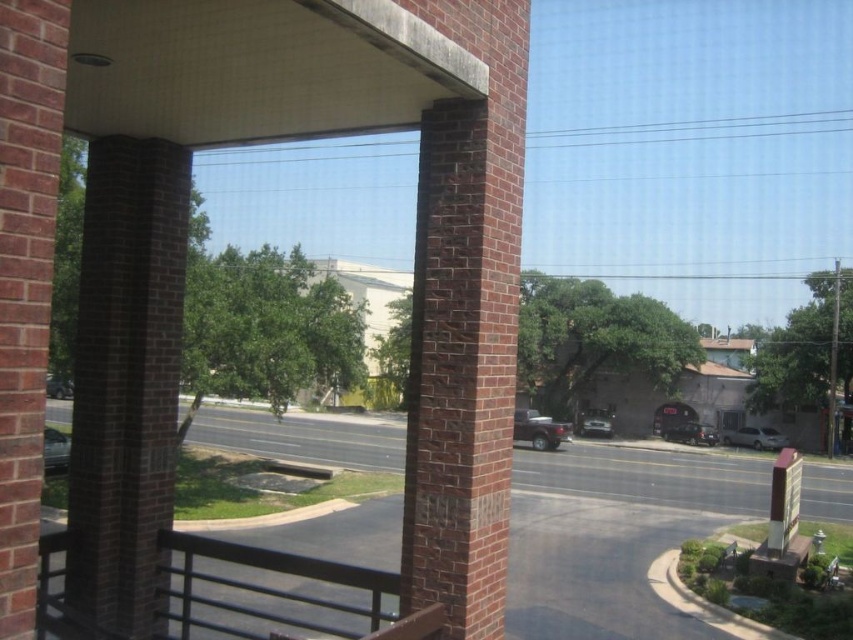
Which of these two, black metal/rail at lower center or matte black truck at center, stands taller?

Standing taller between the two is matte black truck at center.

In the scene shown: Who is more forward, (367, 637) or (556, 433)?

Point (367, 637) is in front.

Image resolution: width=853 pixels, height=640 pixels. In order to click on black metal/rail at lower center in this screenshot , I will do `click(283, 589)`.

Which is behind, point (64, 436) or point (47, 372)?

Point (64, 436)

Can you confirm if shiny black car at lower left is positioned to the left of matte black car at lower left?

No, shiny black car at lower left is not to the left of matte black car at lower left.

Is point (57, 468) positioned before point (59, 387)?

Yes, it is in front of point (59, 387).

This screenshot has width=853, height=640. Identify the location of shiny black car at lower left. (55, 451).

Does brick at left have a smaller size compared to black metal/rail at lower center?

Yes.

Can you confirm if brick at left is positioned to the right of black metal/rail at lower center?

Incorrect, brick at left is not on the right side of black metal/rail at lower center.

Does point (109, 413) lie behind point (189, 637)?

That is False.

The image size is (853, 640). I want to click on brick at left, so click(x=125, y=384).